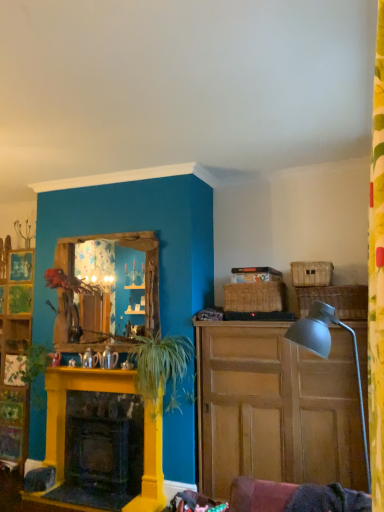
Question: From a real-world perspective, relative to green leafy plant at center, which is the 1th plant in right-to-left order, is woven wicker picnic basket at right, which is the 1th picnic basket from right to left, vertically above or below?

Choices:
 (A) below
 (B) above

Answer: (B)

Question: In terms of height, does woven wicker picnic basket at right, which is the 1th picnic basket from right to left, look taller or shorter compared to green leafy plant at center, positioned as the second plant in left-to-right order?

Choices:
 (A) short
 (B) tall

Answer: (A)

Question: Based on their relative distances, which object is farther from the green leafy plant at left, the second plant positioned from the right?

Choices:
 (A) fluffy fabric flower at upper left
 (B) wooden cabinet at right
 (C) matte gray lamp at right
 (D) wooden mirror at center
 (E) woven brown picnic basket at upper right, which is the second picnic basket in left-to-right order

Answer: (C)

Question: Considering the real-world distances, which object is farthest from the woven brown picnic basket at upper right, acting as the 2th picnic basket starting from the right?

Choices:
 (A) yellow painted wood fireplace at lower left
 (B) woven brown picnic basket at upper right, marked as the 1th picnic basket in a left-to-right arrangement
 (C) green leafy plant at center, which is the 1th plant in right-to-left order
 (D) green leafy plant at left, the second plant positioned from the right
 (E) matte gray lamp at right

Answer: (D)